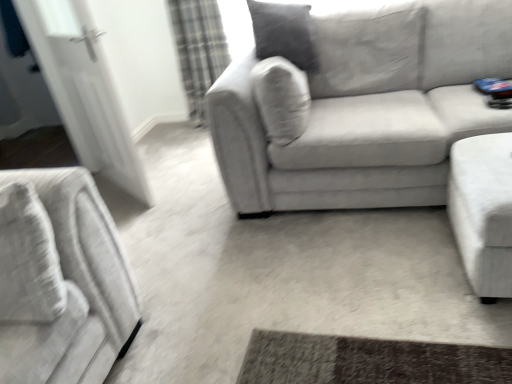
Question: Is plaid fabric curtain at upper left taller or shorter than velvet gray couch at center, acting as the first studio couch starting from the left?

Choices:
 (A) short
 (B) tall

Answer: (B)

Question: From the image's perspective, is plaid fabric curtain at upper left located above or below velvet gray couch at center, acting as the first studio couch starting from the left?

Choices:
 (A) below
 (B) above

Answer: (B)

Question: Based on their relative distances, which object is farther from the plaid fabric curtain at upper left?

Choices:
 (A) velvet gray couch at center, which is the second studio couch from right to left
 (B) white fabric ottoman at right, arranged as the 1th studio couch when viewed from the right
 (C) white glossy door at left

Answer: (B)

Question: Estimate the real-world distances between objects in this image. Which object is closer to the velvet gray couch at center, acting as the first studio couch starting from the left?

Choices:
 (A) white fabric ottoman at right, which is counted as the second studio couch, starting from the left
 (B) white glossy door at left
 (C) plaid fabric curtain at upper left

Answer: (A)